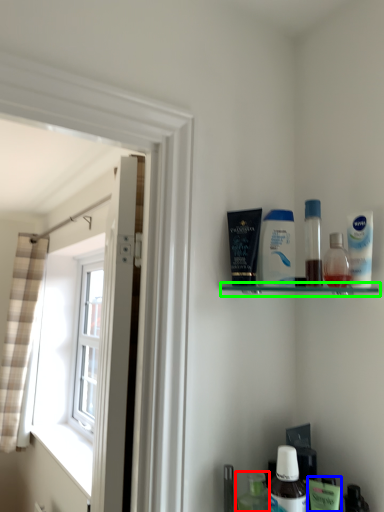
Question: Which object is positioned farthest from toiletry (highlighted by a red box)? Select from mouthwash (highlighted by a blue box) and shelf (highlighted by a green box).

Choices:
 (A) mouthwash
 (B) shelf

Answer: (B)